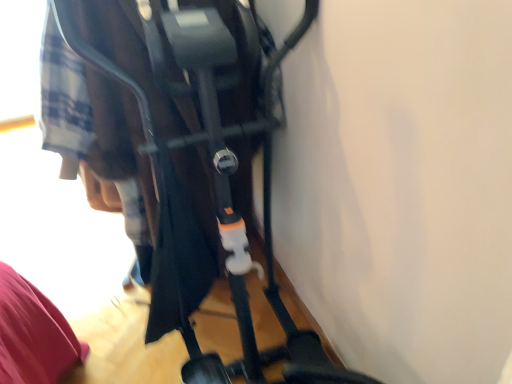
What do you see at coordinates (188, 157) in the screenshot?
I see `black plastic baby carriage at center` at bounding box center [188, 157].

What is the approximate height of black plastic baby carriage at center?

It is 4.43 feet.

I want to click on black plastic baby carriage at center, so click(188, 157).

Locate an element on the screen. The image size is (512, 384). black plastic baby carriage at center is located at coordinates (188, 157).